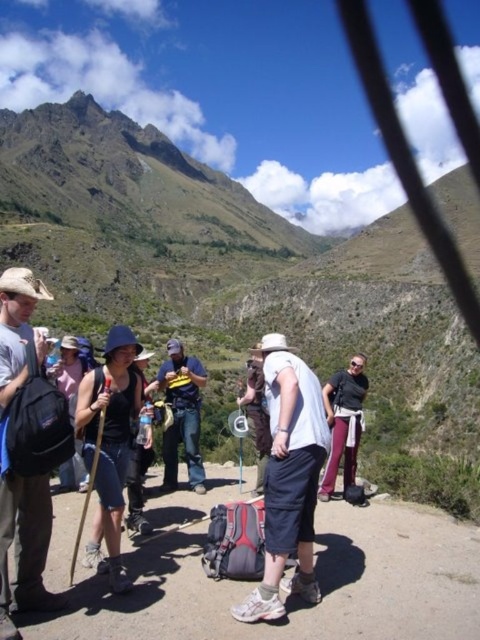
Looking at this image, between matte black backpack at center and matte black shirt at center, which one has more height?

Standing taller between the two is matte black backpack at center.

Which is in front, point (99, 381) or point (346, 433)?

Point (99, 381)

Does point (110, 396) come behind point (346, 438)?

No.

This screenshot has height=640, width=480. What are the coordinates of `matte black backpack at center` in the screenshot? It's located at (108, 444).

Is white cotton shirt at center to the left of matte black backpack at left from the viewer's perspective?

No, white cotton shirt at center is not to the left of matte black backpack at left.

Which is behind, point (285, 474) or point (40, 333)?

Positioned behind is point (40, 333).

Between point (269, 508) and point (24, 588), which one is positioned in front?

Point (24, 588)

You are a GUI agent. You are given a task and a screenshot of the screen. Output one action in this format:
    pyautogui.click(x=<x>, y=<y>)
    Task: Click on the white cotton shirt at center
    Image resolution: width=480 pixels, height=640 pixels.
    Given the screenshot: What is the action you would take?
    pyautogui.click(x=288, y=480)

Based on the photo, who is positioned more to the right, denim jeans at center or matte black shirt at center?

matte black shirt at center

Is denim jeans at center positioned behind matte black shirt at center?

That is True.

Between point (190, 484) and point (323, 477), which one is positioned in front?

Positioned in front is point (323, 477).

At what (x,y) coordinates should I click in order to perform the action: click on denim jeans at center. Please return your answer as a coordinate pair (x, y). Looking at the image, I should click on (181, 416).